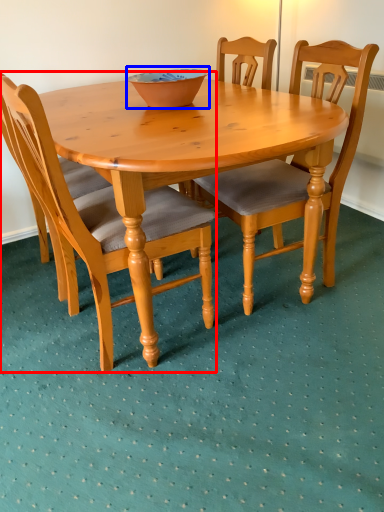
Question: Which object is closer to the camera taking this photo, chair (highlighted by a red box) or bowl (highlighted by a blue box)?

Choices:
 (A) chair
 (B) bowl

Answer: (A)